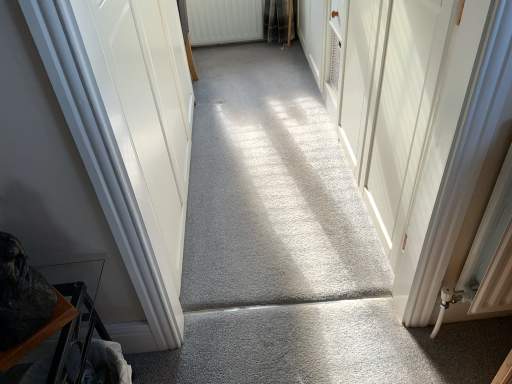
Question: Looking at their shapes, would you say white textured radiator at upper center is wider or thinner than gray carpet at center?

Choices:
 (A) wide
 (B) thin

Answer: (B)

Question: Considering the positions of white textured radiator at upper center and gray carpet at center in the image, is white textured radiator at upper center taller or shorter than gray carpet at center?

Choices:
 (A) short
 (B) tall

Answer: (B)

Question: From a real-world perspective, is white textured radiator at upper center positioned above or below gray carpet at center?

Choices:
 (A) above
 (B) below

Answer: (A)

Question: From a real-world perspective, is gray carpet at center above or below white textured radiator at upper center?

Choices:
 (A) above
 (B) below

Answer: (B)

Question: From their relative heights in the image, would you say gray carpet at center is taller or shorter than white textured radiator at upper center?

Choices:
 (A) tall
 (B) short

Answer: (B)

Question: Is gray carpet at center in front of or behind white textured radiator at upper center in the image?

Choices:
 (A) behind
 (B) front

Answer: (B)

Question: In terms of width, does gray carpet at center look wider or thinner when compared to white textured radiator at upper center?

Choices:
 (A) wide
 (B) thin

Answer: (A)